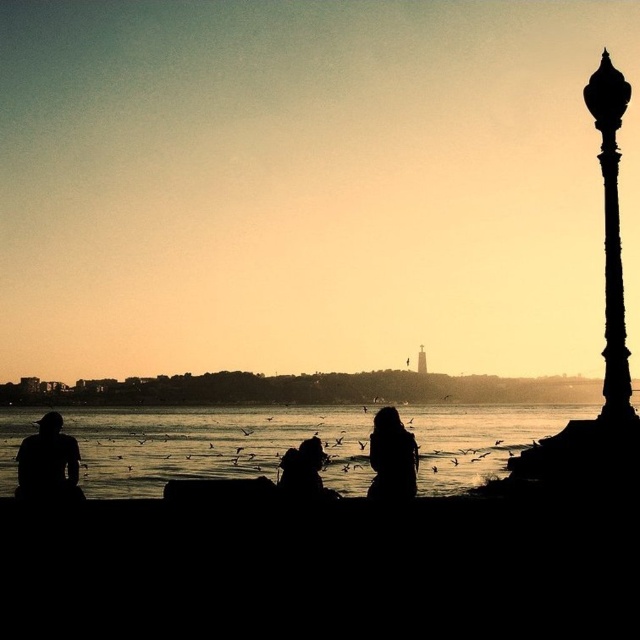
Question: Which is nearer to the black polished metal lamp post at right?

Choices:
 (A) matte black jacket at lower left
 (B) silhouette hoodie at center
 (C) transparent water at lower center

Answer: (B)

Question: Which object is the closest to the black polished metal lamp post at right?

Choices:
 (A) matte black jacket at lower left
 (B) black matte coat at center

Answer: (B)

Question: Which point is farther to the camera?

Choices:
 (A) matte black jacket at lower left
 (B) black matte coat at center

Answer: (A)

Question: Is matte black jacket at lower left below silhouette hoodie at center?

Choices:
 (A) yes
 (B) no

Answer: (B)

Question: Is transparent water at lower center behind black polished metal lamp post at right?

Choices:
 (A) no
 (B) yes

Answer: (B)

Question: Can you confirm if matte black jacket at lower left is positioned below silhouette hoodie at center?

Choices:
 (A) yes
 (B) no

Answer: (B)